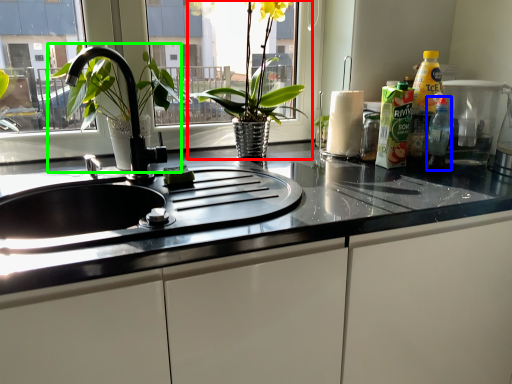
Question: Which object is positioned farthest from houseplant (highlighted by a red box)? Select from bottle (highlighted by a blue box) and tap (highlighted by a green box).

Choices:
 (A) bottle
 (B) tap

Answer: (A)